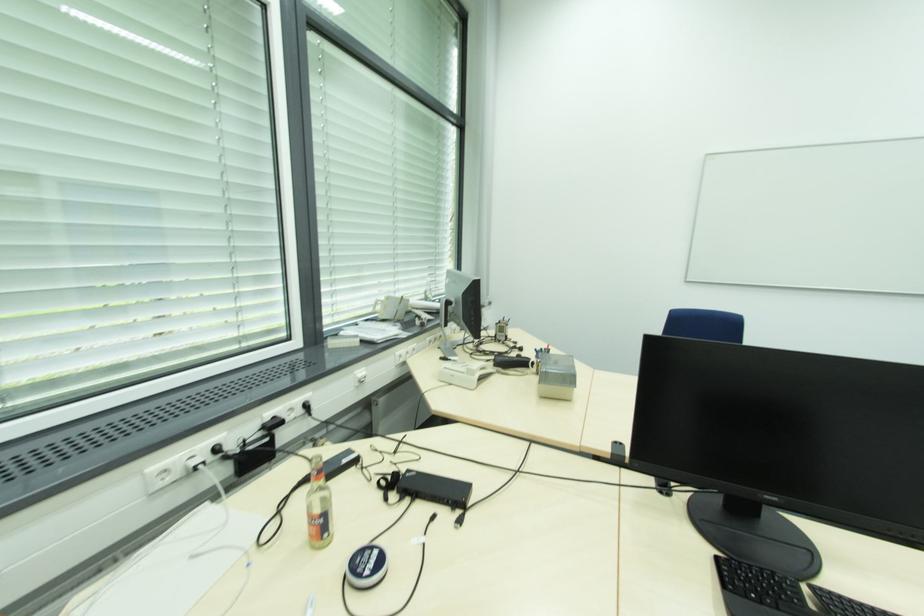
This screenshot has height=616, width=924. What do you see at coordinates (478, 368) in the screenshot? I see `the telephone handset` at bounding box center [478, 368].